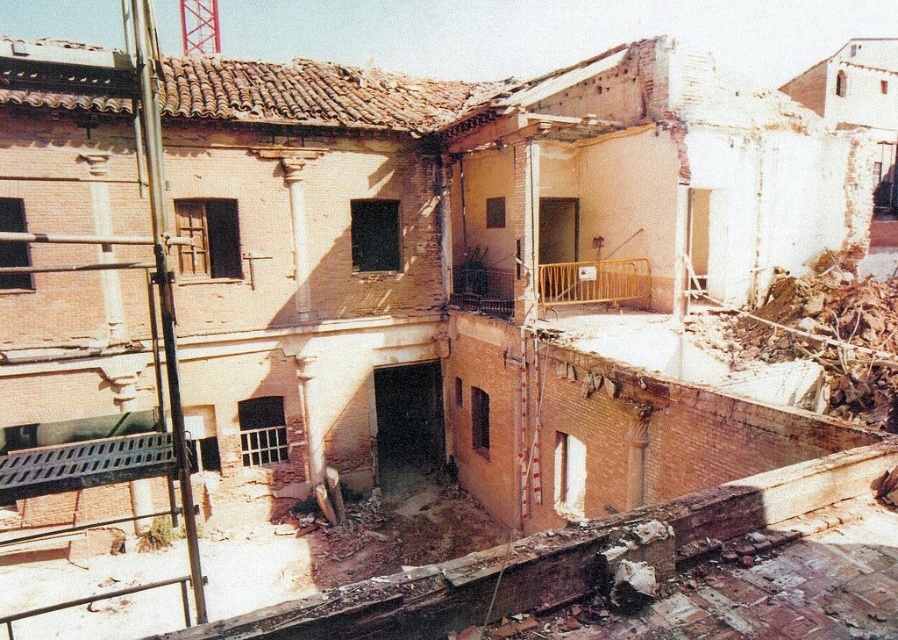
Who is more forward, (49, 467) or (568, 280)?

Point (49, 467)

Who is shorter, metallic grid at lower left or yellow metallic railing at center?

Result: metallic grid at lower left is shorter.

Does point (46, 474) come in front of point (584, 291)?

Yes, point (46, 474) is closer to viewer.

Find the location of a particular element. metallic grid at lower left is located at coordinates (89, 465).